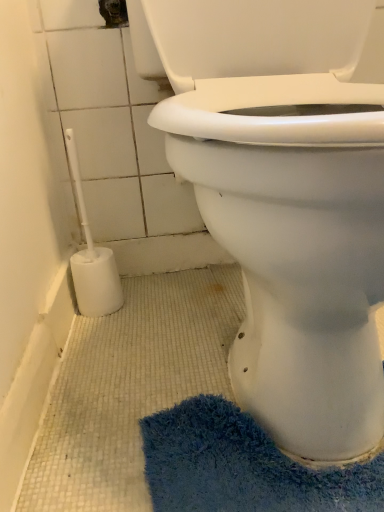
Question: From the image's perspective, is white plastic toilet brush at lower left below blue shaggy bath mat at lower right?

Choices:
 (A) no
 (B) yes

Answer: (A)

Question: From the image's perspective, is white plastic toilet brush at lower left on blue shaggy bath mat at lower right?

Choices:
 (A) no
 (B) yes

Answer: (B)

Question: Is white plastic toilet brush at lower left facing towards blue shaggy bath mat at lower right?

Choices:
 (A) yes
 (B) no

Answer: (B)

Question: Is white plastic toilet brush at lower left next to blue shaggy bath mat at lower right and touching it?

Choices:
 (A) yes
 (B) no

Answer: (B)

Question: Would you say white plastic toilet brush at lower left is a long distance from blue shaggy bath mat at lower right?

Choices:
 (A) no
 (B) yes

Answer: (A)

Question: From the image's perspective, is blue shaggy bath mat at lower right positioned above or below white plastic toilet brush at left?

Choices:
 (A) below
 (B) above

Answer: (A)

Question: Relative to white plastic toilet brush at left, is blue shaggy bath mat at lower right in front or behind?

Choices:
 (A) behind
 (B) front

Answer: (A)

Question: Is point pos(241,443) closer or farther from the camera than point pos(304,105)?

Choices:
 (A) closer
 (B) farther

Answer: (A)

Question: From a real-world perspective, is blue shaggy bath mat at lower right positioned above or below white plastic toilet brush at left?

Choices:
 (A) above
 (B) below

Answer: (B)

Question: Considering the positions of white plastic toilet brush at lower left and blue shaggy bath mat at lower right in the image, is white plastic toilet brush at lower left bigger or smaller than blue shaggy bath mat at lower right?

Choices:
 (A) small
 (B) big

Answer: (B)

Question: Is white plastic toilet brush at lower left taller or shorter than blue shaggy bath mat at lower right?

Choices:
 (A) tall
 (B) short

Answer: (A)

Question: From a real-world perspective, is white plastic toilet brush at lower left physically located above or below blue shaggy bath mat at lower right?

Choices:
 (A) below
 (B) above

Answer: (B)

Question: From the image's perspective, is white plastic toilet brush at lower left located above or below blue shaggy bath mat at lower right?

Choices:
 (A) below
 (B) above

Answer: (B)

Question: Does point pos(112,271) appear closer or farther from the camera than point pos(228,181)?

Choices:
 (A) closer
 (B) farther

Answer: (B)

Question: Is white plastic toilet brush at lower left to the left or to the right of white plastic toilet brush at left in the image?

Choices:
 (A) left
 (B) right

Answer: (A)